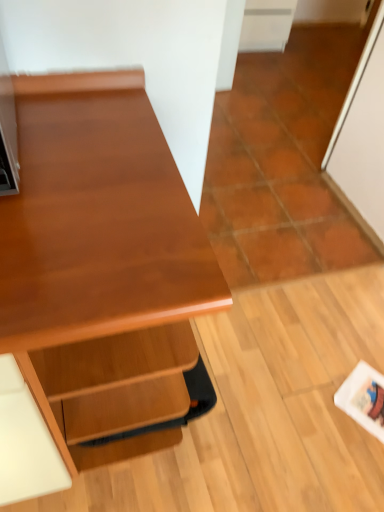
Locate an element on the screen. The image size is (384, 512). spots to the right of wooden desk at center is located at coordinates (256, 397).